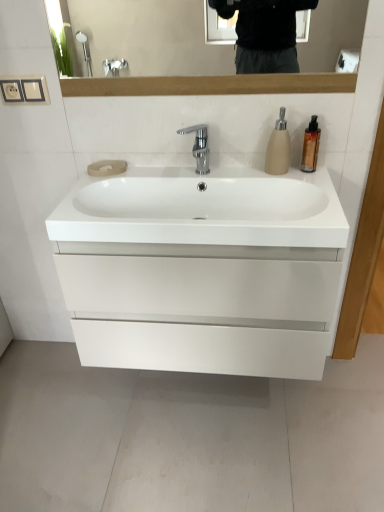
This screenshot has height=512, width=384. I want to click on vacant region to the left of gold metallic soap dispenser at upper right, which appears as the 2th soap dispenser when viewed from the left, so click(263, 172).